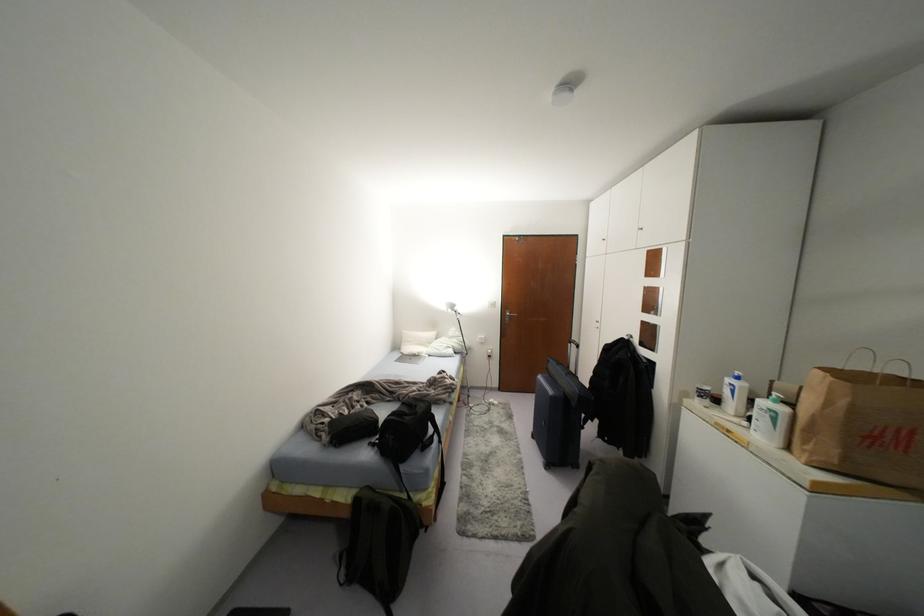
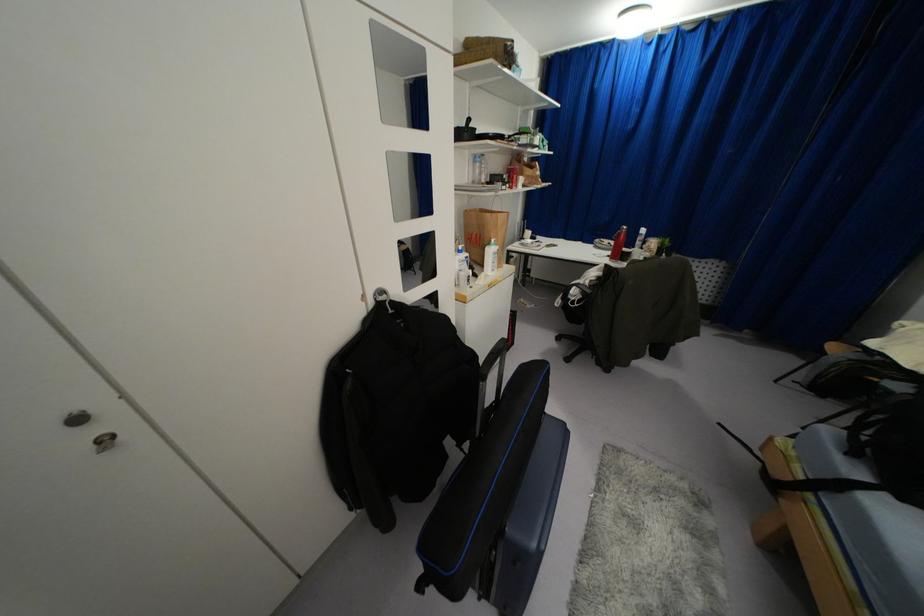
In the second image, find the point that corresponds to pixel 782 408 in the first image.

(495, 246)